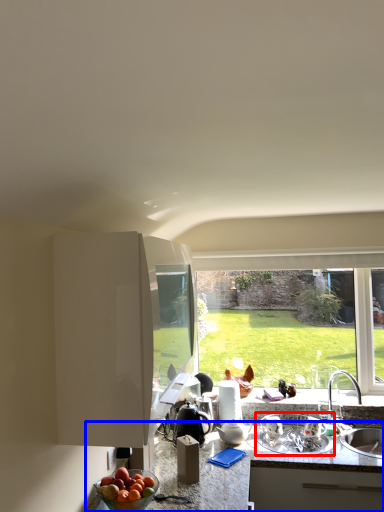
Question: Which object is closer to the camera taking this photo, appliance (highlighted by a red box) or countertop (highlighted by a blue box)?

Choices:
 (A) appliance
 (B) countertop

Answer: (B)